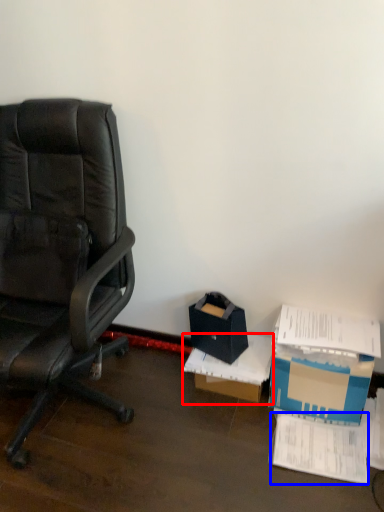
Question: Which of the following is the farthest to the observer, cardboard box (highlighted by a red box) or paperback book (highlighted by a blue box)?

Choices:
 (A) cardboard box
 (B) paperback book

Answer: (A)